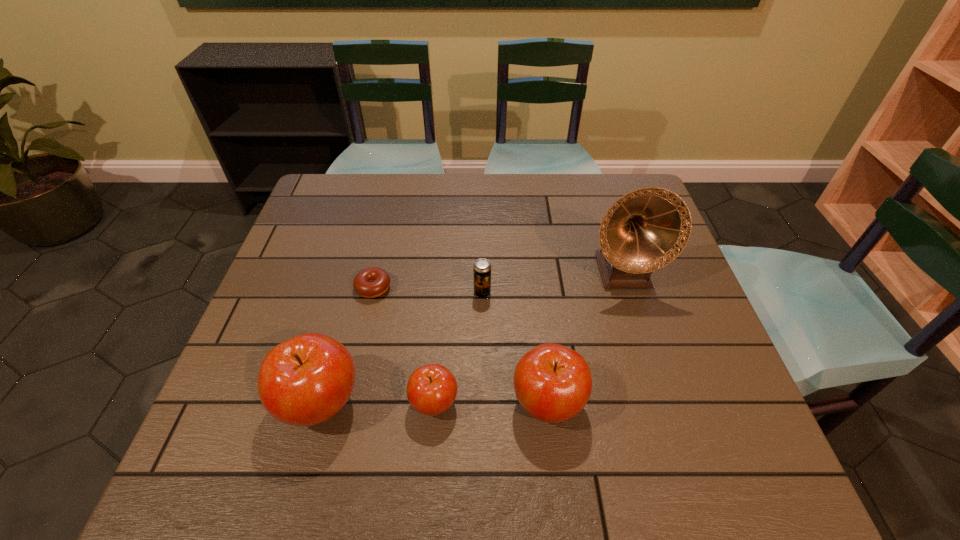
At what (x,y) coordinates should I click in order to perform the action: click on free space between the shortest object and the phonograph record. Please return your answer as a coordinate pair (x, y). The height and width of the screenshot is (540, 960). Looking at the image, I should click on (497, 280).

Where is `vacant space in between the shortest apple and the fourth object from left to right`? The height and width of the screenshot is (540, 960). vacant space in between the shortest apple and the fourth object from left to right is located at coordinates (458, 348).

The width and height of the screenshot is (960, 540). Find the location of `free spot between the leftmost apple and the phonograph record`. free spot between the leftmost apple and the phonograph record is located at coordinates (471, 337).

Point out which object is positioned as the second nearest to the shortest object. Please provide its 2D coordinates. Your answer should be formatted as a tuple, i.e. [(x, y)], where the tuple contains the x and y coordinates of a point satisfying the conditions above.

[(482, 268)]

Find the location of a particular element. The height and width of the screenshot is (540, 960). object that stands as the third closest to the tallest object is located at coordinates (431, 389).

At what (x,y) coordinates should I click in order to perform the action: click on apple that is the closest to the beer can. Please return your answer as a coordinate pair (x, y). Looking at the image, I should click on (553, 383).

Select which apple is the closest to the rightmost apple. Please provide its 2D coordinates. Your answer should be formatted as a tuple, i.e. [(x, y)], where the tuple contains the x and y coordinates of a point satisfying the conditions above.

[(431, 389)]

Find the location of a particular element. The image size is (960, 540). free location that satisfies the following two spatial constraints: 1. on the back side of the beer can; 2. on the right side of the shortest apple is located at coordinates (443, 293).

Where is `vacant position in the image that satisfies the following two spatial constraints: 1. on the front side of the leftmost apple; 2. on the left side of the second apple from left to right`? vacant position in the image that satisfies the following two spatial constraints: 1. on the front side of the leftmost apple; 2. on the left side of the second apple from left to right is located at coordinates (321, 402).